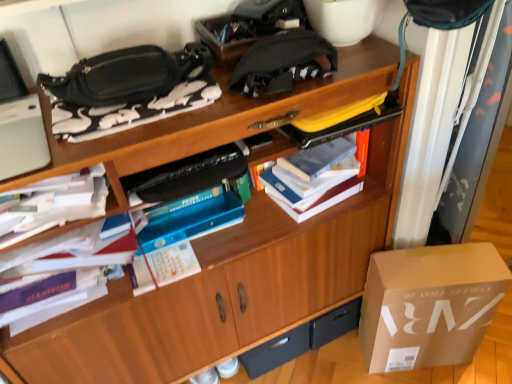
Question: Does white paper at left, which is the second book in left-to-right order, have a lesser height compared to hardcover book at center, the 4th book from the left?

Choices:
 (A) no
 (B) yes

Answer: (B)

Question: Considering the relative sizes of white paper at left, acting as the third book starting from the right, and hardcover book at center, the 4th book from the left, in the image provided, is white paper at left, acting as the third book starting from the right, wider than hardcover book at center, the 4th book from the left,?

Choices:
 (A) yes
 (B) no

Answer: (A)

Question: From the image's perspective, does white paper at left, acting as the third book starting from the right, appear higher than hardcover book at center, placed as the first book when sorted from right to left?

Choices:
 (A) no
 (B) yes

Answer: (A)

Question: Would you consider white paper at left, acting as the third book starting from the right, to be distant from hardcover book at center, placed as the first book when sorted from right to left?

Choices:
 (A) yes
 (B) no

Answer: (B)

Question: Is white paper at left, which is the second book in left-to-right order, bigger than hardcover book at center, placed as the first book when sorted from right to left?

Choices:
 (A) no
 (B) yes

Answer: (A)

Question: From the image's perspective, would you say white paper at left, acting as the third book starting from the right, is shown under hardcover book at center, the 4th book from the left?

Choices:
 (A) no
 (B) yes

Answer: (B)

Question: Is white fabric curtain at upper right turned away from black matte bag at upper left, which appears as the second book when viewed from the right?

Choices:
 (A) yes
 (B) no

Answer: (B)

Question: Considering the relative sizes of white fabric curtain at upper right and black matte bag at upper left, positioned as the third book in left-to-right order, in the image provided, is white fabric curtain at upper right smaller than black matte bag at upper left, positioned as the third book in left-to-right order,?

Choices:
 (A) no
 (B) yes

Answer: (A)

Question: From the image's perspective, is white fabric curtain at upper right on top of black matte bag at upper left, positioned as the third book in left-to-right order?

Choices:
 (A) yes
 (B) no

Answer: (B)

Question: Is white fabric curtain at upper right next to black matte bag at upper left, which appears as the second book when viewed from the right, and touching it?

Choices:
 (A) no
 (B) yes

Answer: (A)

Question: Can we say white fabric curtain at upper right lies outside black matte bag at upper left, which appears as the second book when viewed from the right?

Choices:
 (A) yes
 (B) no

Answer: (A)

Question: From a real-world perspective, is white fabric curtain at upper right positioned over black matte bag at upper left, positioned as the third book in left-to-right order, based on gravity?

Choices:
 (A) yes
 (B) no

Answer: (B)

Question: Does white paper stack at left, which ranks as the 1th book in left-to-right order, have a lesser width compared to black matte drawer at lower center?

Choices:
 (A) no
 (B) yes

Answer: (A)